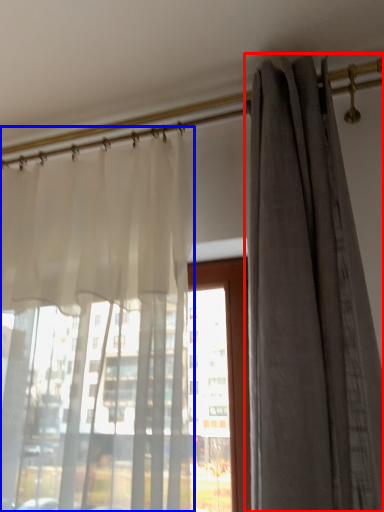
Question: Which of the following is the farthest to the observer, curtain (highlighted by a red box) or curtain (highlighted by a blue box)?

Choices:
 (A) curtain
 (B) curtain

Answer: (B)